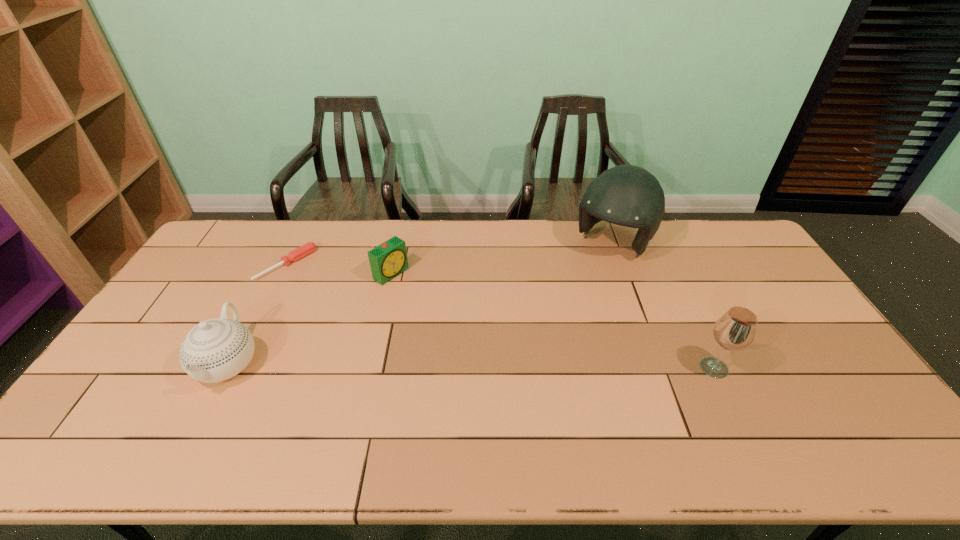
Locate an element on the screen. Image resolution: width=960 pixels, height=540 pixels. the third shortest object is located at coordinates (215, 350).

Identify the location of wineglass. (735, 330).

Where is `alarm clock`? alarm clock is located at coordinates (x=389, y=259).

Locate an element on the screen. the third object from right to left is located at coordinates pyautogui.click(x=389, y=259).

Locate an element on the screen. The height and width of the screenshot is (540, 960). screwdriver is located at coordinates (302, 251).

The height and width of the screenshot is (540, 960). I want to click on football helmet, so click(627, 195).

You are a GUI agent. You are given a task and a screenshot of the screen. Output one action in this format:
    pyautogui.click(x=<x>, y=<y>)
    Task: Click on the vacant point located 0.180m on the left of the fourth shortest object
    This screenshot has width=960, height=540.
    Given the screenshot: What is the action you would take?
    pyautogui.click(x=630, y=368)

Where is `vacant space located 0.100m on the front-facing side of the alarm clock`? vacant space located 0.100m on the front-facing side of the alarm clock is located at coordinates (423, 295).

At what (x,y) coordinates should I click in order to perform the action: click on free space located 0.170m on the front-facing side of the alarm clock. Please return your answer as a coordinate pair (x, y). The width and height of the screenshot is (960, 540). Looking at the image, I should click on (439, 306).

The width and height of the screenshot is (960, 540). I want to click on vacant space located on the front-facing side of the alarm clock, so click(423, 295).